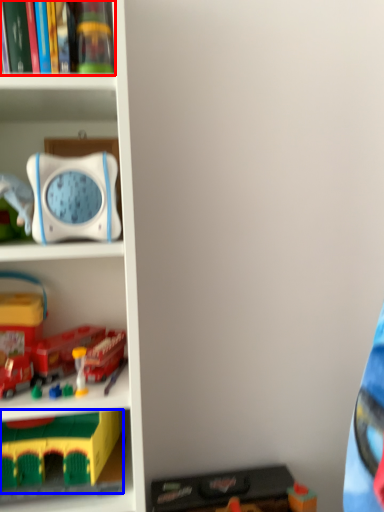
Question: Which point is further to the camera, book (highlighted by a red box) or toy (highlighted by a blue box)?

Choices:
 (A) book
 (B) toy

Answer: (B)